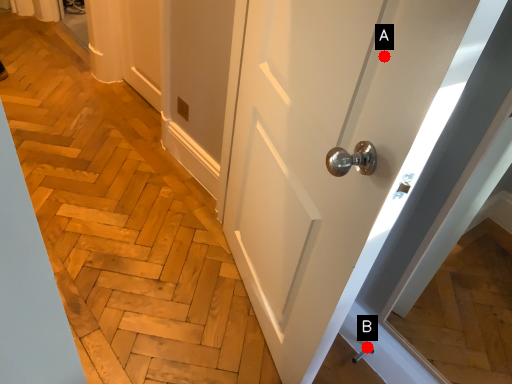
Question: Two points are circled on the image, labeled by A and B beside each circle. Which point appears farthest from the camera in this image?

Choices:
 (A) A is further
 (B) B is further

Answer: (B)